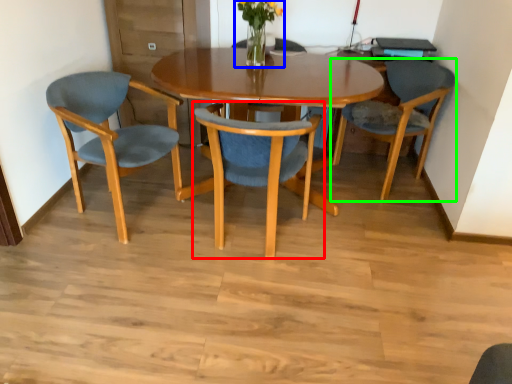
Question: Considering the real-world distances, which object is farthest from chair (highlighted by a red box)? floral arrangement (highlighted by a blue box) or chair (highlighted by a green box)?

Choices:
 (A) floral arrangement
 (B) chair

Answer: (B)